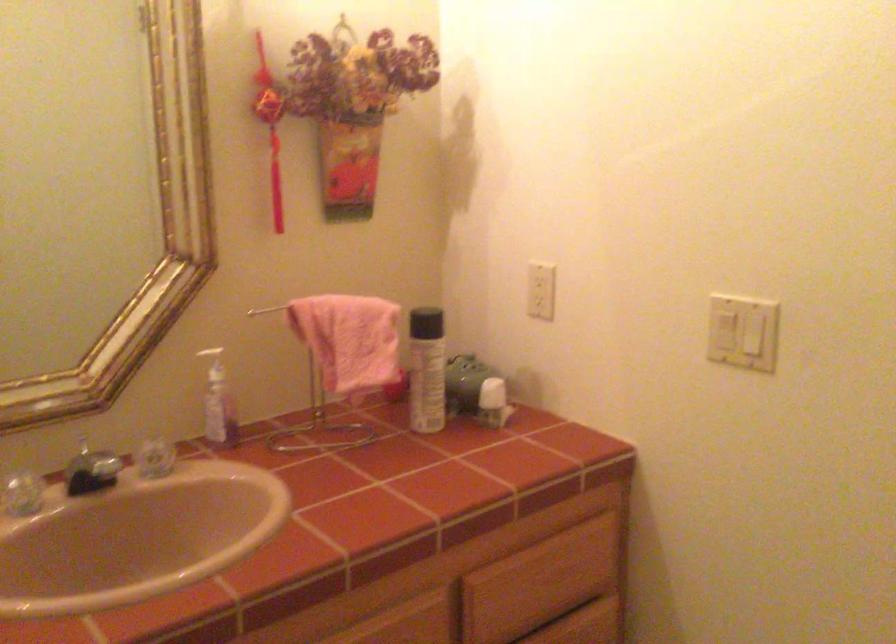
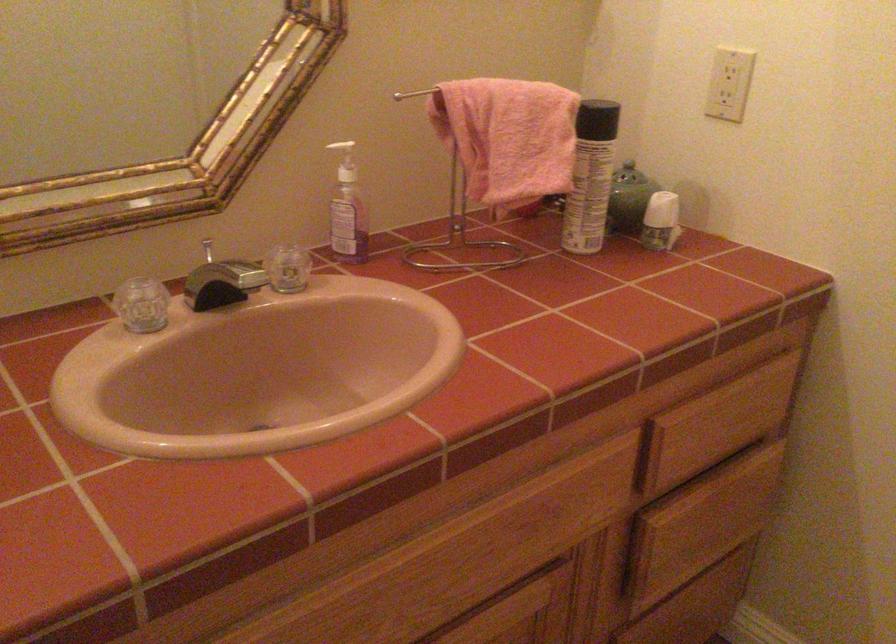
The point at (469, 366) is marked in the first image. Where is the corresponding point in the second image?

(629, 175)